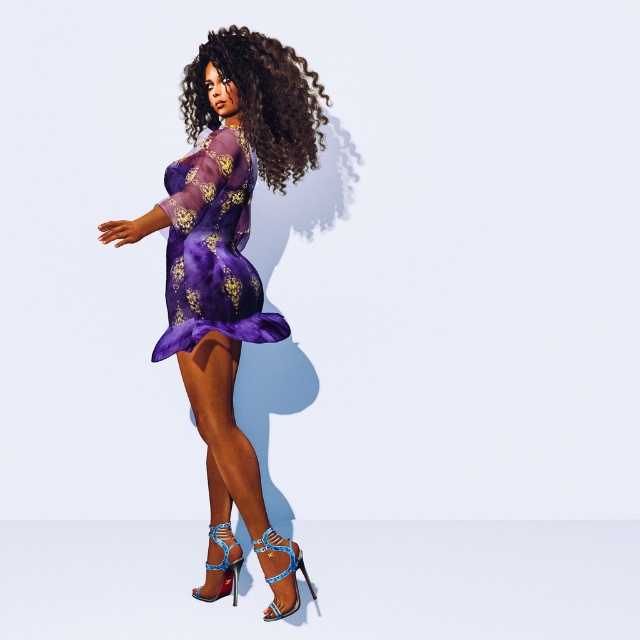
The scene shows a person wearing a purple dress with yellow flowers. There is a specific point in the image at coordinates point (259, 100). What is located at that point?

At point (259, 100) lies curly hair at upper center.

You are a fashion designer observing the image. You need to decide which item, the purple sheer dress at center or the curly hair at upper center, would require more fabric to cover its width. Which one would need more fabric?

The curly hair at upper center would require more fabric to cover its width since the purple sheer dress at center has a lesser width compared to curly hair at upper center.